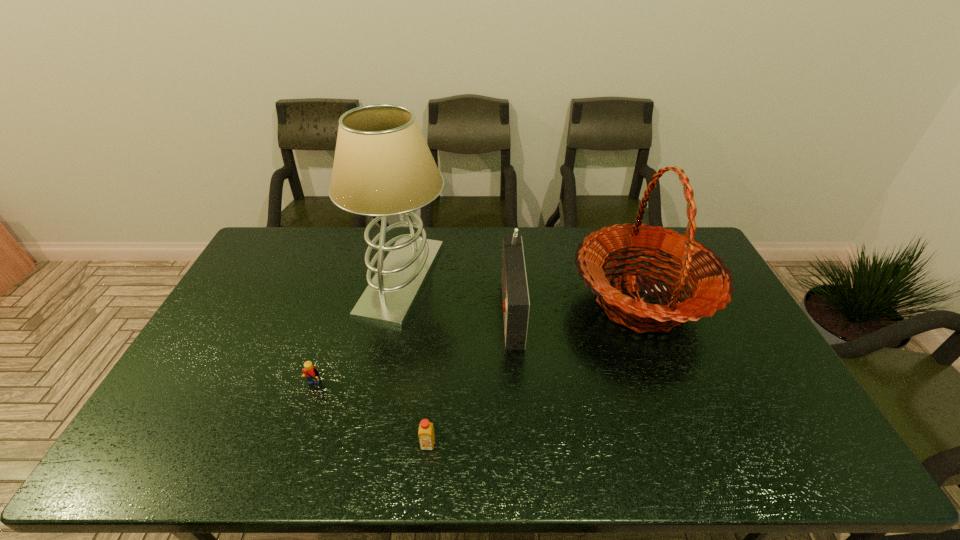
Locate an element on the screen. The height and width of the screenshot is (540, 960). blank region between the shortest object and the table lamp is located at coordinates (415, 362).

At what (x,y) coordinates should I click in order to perform the action: click on empty space between the tallest object and the second nearest object. Please return your answer as a coordinate pair (x, y). Looking at the image, I should click on (357, 334).

Find the location of a particular element. This screenshot has width=960, height=540. empty space that is in between the radio receiver and the nearest object is located at coordinates (469, 376).

Locate an element on the screen. The width and height of the screenshot is (960, 540). the third closest object to the table lamp is located at coordinates (426, 435).

The height and width of the screenshot is (540, 960). Find the location of `object identified as the fourth closest to the rightmost object`. object identified as the fourth closest to the rightmost object is located at coordinates (310, 372).

In order to click on vacant position in the image that satisfies the following two spatial constraints: 1. on the front panel of the third shortest object; 2. on the front and back of the shortest object in this screenshot , I will do `click(520, 444)`.

Where is `free space that satisfies the following two spatial constraints: 1. on the front side of the basket; 2. on the right side of the table lamp`? Image resolution: width=960 pixels, height=540 pixels. free space that satisfies the following two spatial constraints: 1. on the front side of the basket; 2. on the right side of the table lamp is located at coordinates (396, 302).

The height and width of the screenshot is (540, 960). Find the location of `free space that satisfies the following two spatial constraints: 1. on the front panel of the radio receiver; 2. on the front-facing side of the fourth tallest object`. free space that satisfies the following two spatial constraints: 1. on the front panel of the radio receiver; 2. on the front-facing side of the fourth tallest object is located at coordinates coord(516,389).